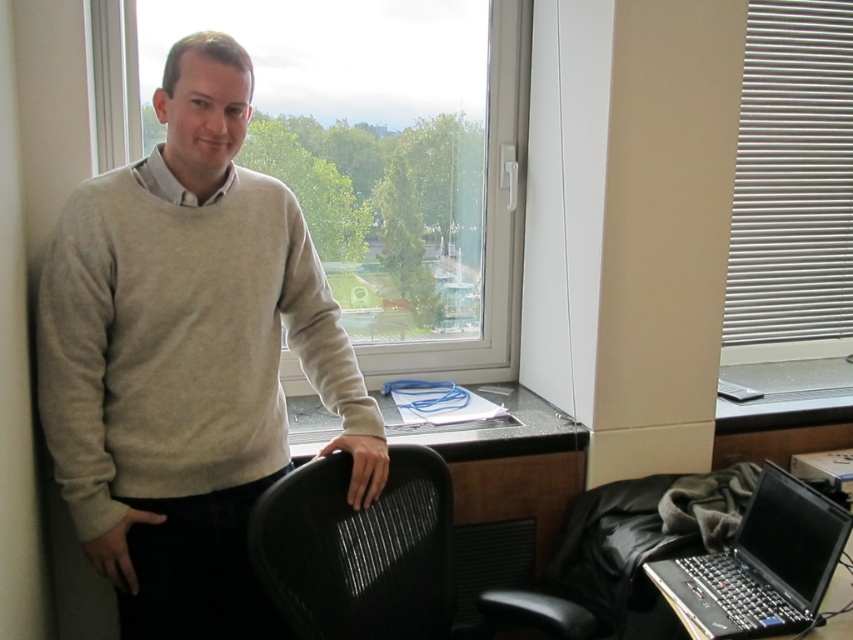
You are standing in an office and see two points marked on the wall. The first point is at coordinates point [440,326] and the second point is at point [781,333]. Which point is closer to you?

Point [440,326] is in front of point [781,333], so it is closer to you.

You are an office worker trying to locate your beige sweater at center and transparent glass window at upper center. Which object is positioned to the left side of the other?

The beige sweater at center is to the left of the transparent glass window at upper center.

Where is the beige sweater at center located in the image?

The beige sweater at center is located at point (187, 358).